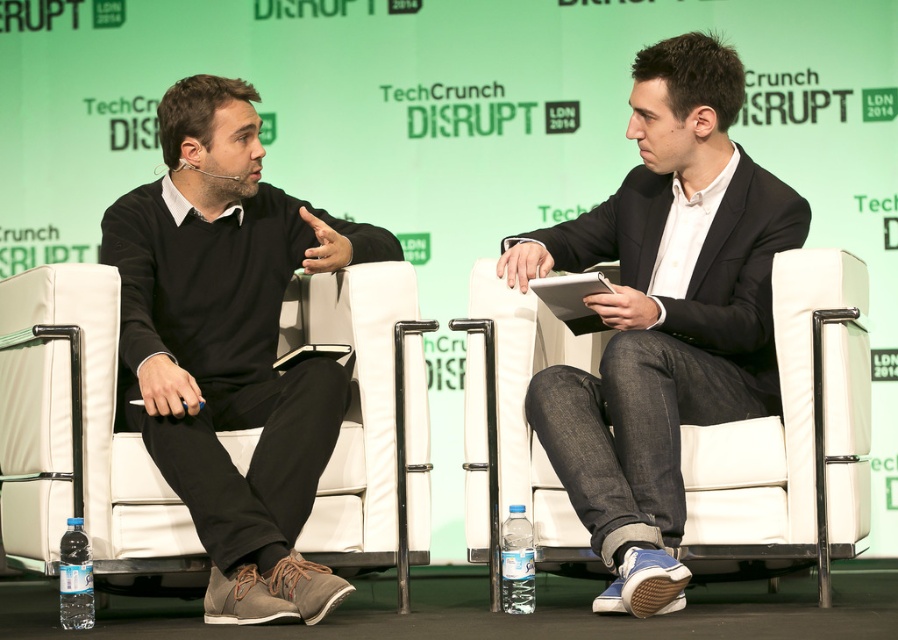
Is white leather chair at left shorter than white leather chair at center?

Yes.

Which is below, white leather chair at left or white leather chair at center?

white leather chair at center is lower down.

Identify the location of white leather chair at left. (367, 417).